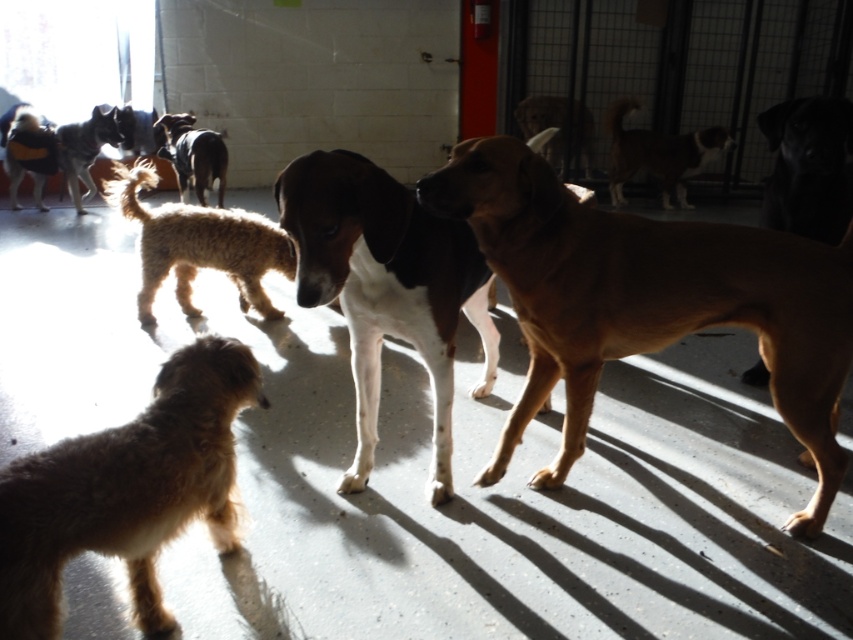
Is point (566, 200) less distant than point (799, 128)?

That is True.

Based on the photo, is brown smooth dog at center positioned behind black smooth dog at upper right?

No, brown smooth dog at center is in front of black smooth dog at upper right.

You are a GUI agent. You are given a task and a screenshot of the screen. Output one action in this format:
    pyautogui.click(x=<x>, y=<y>)
    Task: Click on the brown smooth dog at center
    The height and width of the screenshot is (640, 853).
    Given the screenshot: What is the action you would take?
    pyautogui.click(x=648, y=301)

Can you confirm if fuzzy brown dog at lower left is taller than short-haired brown dog at center?

No, fuzzy brown dog at lower left is not taller than short-haired brown dog at center.

From the picture: Can you confirm if fuzzy brown dog at lower left is shorter than short-haired brown dog at center?

Yes.

What are the coordinates of `fuzzy brown dog at lower left` in the screenshot? It's located at (126, 490).

Who is lower down, brown smooth dog at center or fuzzy brown dog at lower left?

fuzzy brown dog at lower left

Which is above, brown smooth dog at center or fuzzy brown dog at lower left?

brown smooth dog at center

In order to click on brown smooth dog at center in this screenshot , I will do `click(648, 301)`.

Identify the location of brown smooth dog at center. The height and width of the screenshot is (640, 853). (648, 301).